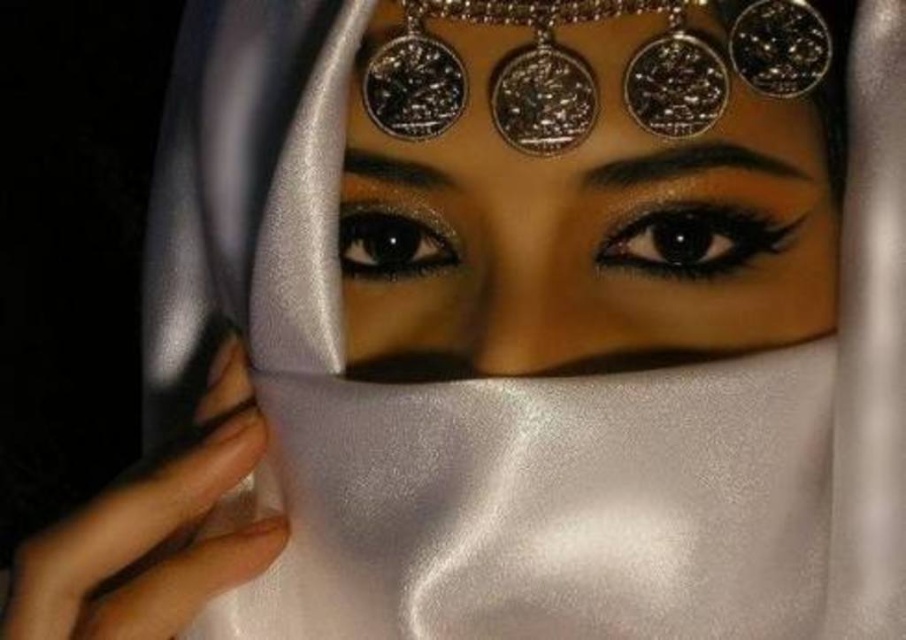
You are an artist trying to paint the scene. You notice the metallic silver coins at center and the black matte eye at center. Which object should you paint first to ensure proper layering?

You should paint the metallic silver coins at center first because they are in front of the black matte eye at center, so they need to be layered on top.

You are an artist trying to sketch this scene. You notice a point marked at coordinates [584,184]. What object is located at this point?

The point at coordinates [584,184] indicates metallic silver coins at center.

You are a photographer using a camera with a 50mm lens. You want to capture a closeup of the metallic silver coins at center while maintaining focus on the subject. If the minimum focusing distance for your camera is 18 inches, will you be able to take the photo without moving closer?

The metallic silver coins at center and camera are 18.34 inches apart, which is slightly beyond the minimum focusing distance of 18 inches. Therefore, you can take the photo without moving closer as the distance is sufficient.